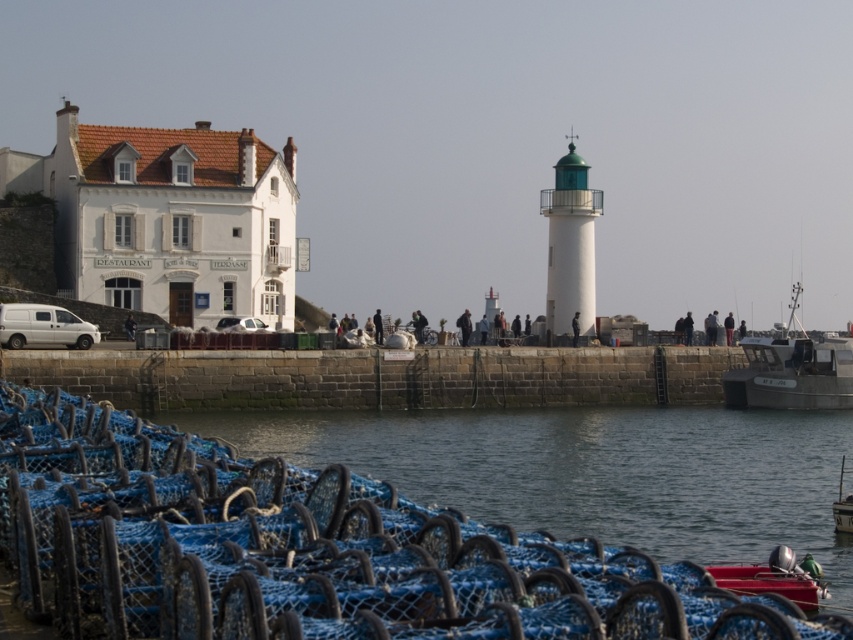
Question: Can you confirm if blue mesh netting at lower center is thinner than white plastic boat at right?

Choices:
 (A) no
 (B) yes

Answer: (A)

Question: Which point is closer to the camera?

Choices:
 (A) blue mesh netting at lower center
 (B) white plastic boat at right
 (C) metallic silver boat at right

Answer: (A)

Question: Among these objects, which one is farthest from the camera?

Choices:
 (A) white plastic boat at right
 (B) metallic silver boat at right

Answer: (A)

Question: Does blue mesh netting at lower center appear under metallic silver boat at right?

Choices:
 (A) yes
 (B) no

Answer: (B)

Question: Can you confirm if blue mesh netting at lower center is positioned to the right of metallic silver boat at right?

Choices:
 (A) no
 (B) yes

Answer: (A)

Question: Based on their relative distances, which object is nearer to the blue mesh netting at lower center?

Choices:
 (A) metallic silver boat at right
 (B) white plastic boat at right

Answer: (A)